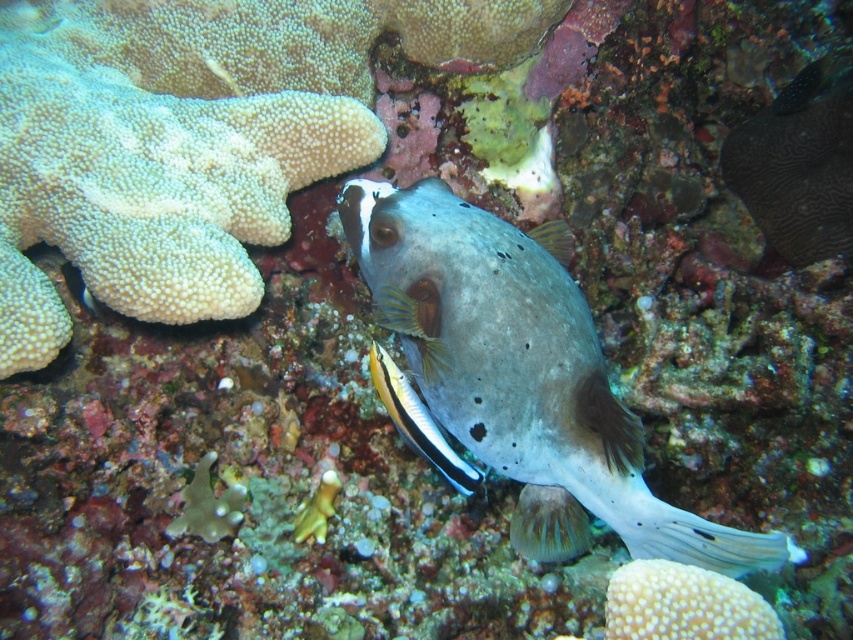
Can you confirm if speckled gray pufferfish at center is positioned to the right of shiny yellow and black fish at center?

Correct, you'll find speckled gray pufferfish at center to the right of shiny yellow and black fish at center.

Which is more to the right, speckled gray pufferfish at center or shiny yellow and black fish at center?

Positioned to the right is speckled gray pufferfish at center.

At what (x,y) coordinates should I click in order to perform the action: click on speckled gray pufferfish at center. Please return your answer as a coordinate pair (x, y). The height and width of the screenshot is (640, 853). Looking at the image, I should click on (524, 374).